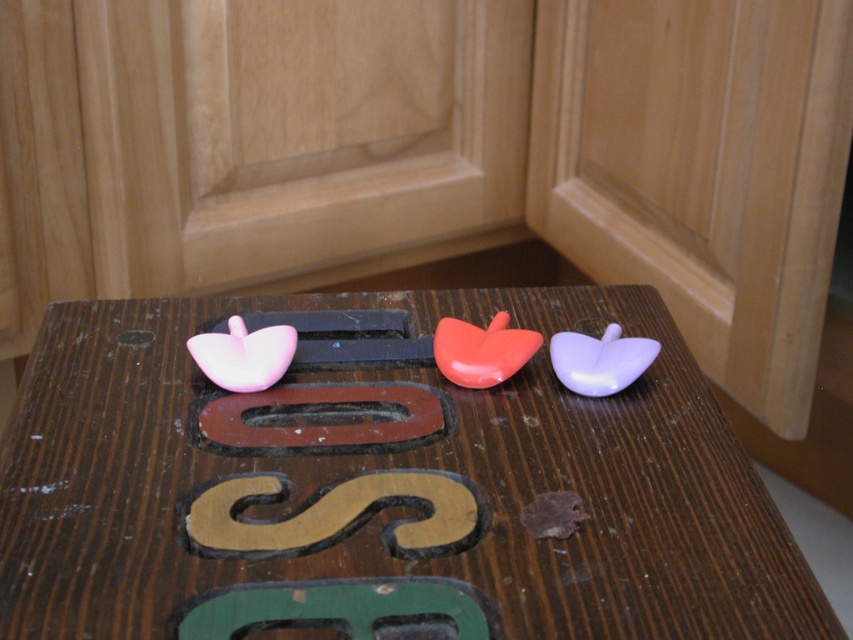
Who is positioned more to the right, brown matte letter s at center or brown matte letter o at center?

From the viewer's perspective, brown matte letter s at center appears more on the right side.

Locate an element on the screen. brown matte letter s at center is located at coordinates (332, 515).

You are a GUI agent. You are given a task and a screenshot of the screen. Output one action in this format:
    pyautogui.click(x=<x>, y=<y>)
    Task: Click on the brown matte letter s at center
    The width and height of the screenshot is (853, 640).
    Given the screenshot: What is the action you would take?
    pyautogui.click(x=332, y=515)

Can you confirm if wooden table at center is positioned to the right of brown matte letter o at center?

Yes, wooden table at center is to the right of brown matte letter o at center.

Can you confirm if wooden table at center is positioned below brown matte letter o at center?

Incorrect, wooden table at center is not positioned below brown matte letter o at center.

Is point (184, 536) behind point (397, 410)?

No, (184, 536) is in front of (397, 410).

Locate an element on the screen. wooden table at center is located at coordinates [381, 490].

Can you confirm if wooden table at center is shorter than brown matte letter s at center?

No, wooden table at center is not shorter than brown matte letter s at center.

Between point (811, 625) and point (253, 490), which one is positioned in front?

Positioned in front is point (811, 625).

Locate an element on the screen. Image resolution: width=853 pixels, height=640 pixels. wooden table at center is located at coordinates (381, 490).

Where is `wooden table at center`? wooden table at center is located at coordinates (381, 490).